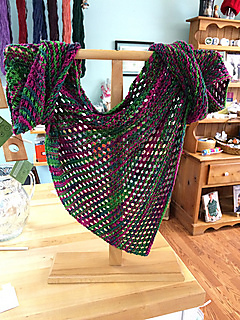
This screenshot has width=240, height=320. I want to click on bar, so pyautogui.click(x=93, y=55), pyautogui.click(x=130, y=54), pyautogui.click(x=116, y=102).